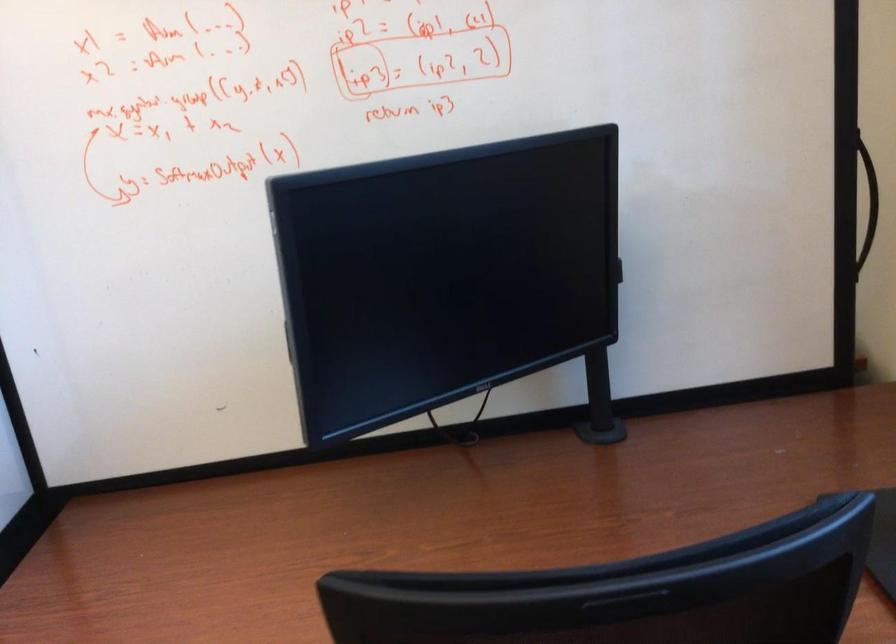
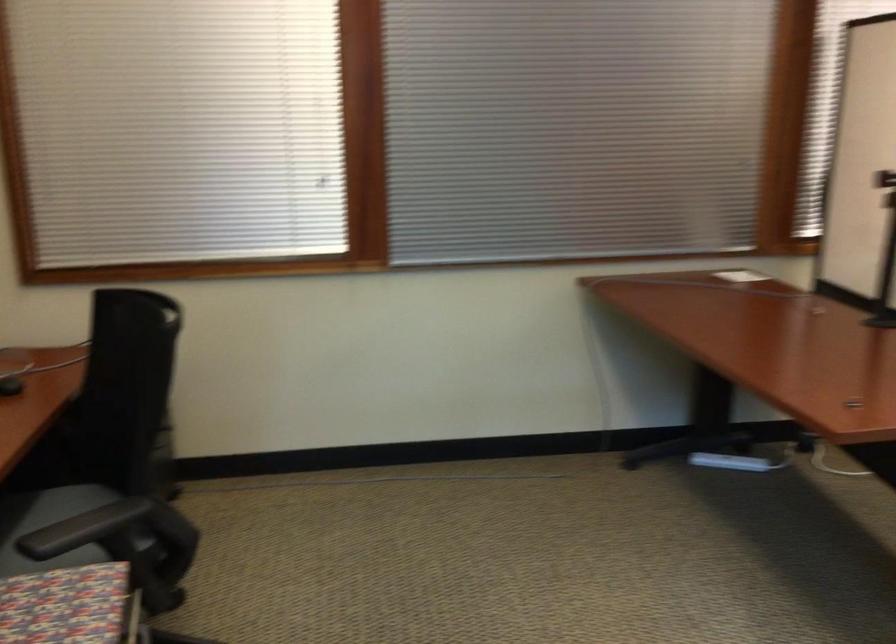
Question: How did the camera likely rotate?

Choices:
 (A) Left
 (B) Right
 (C) Up
 (D) Down

Answer: (A)